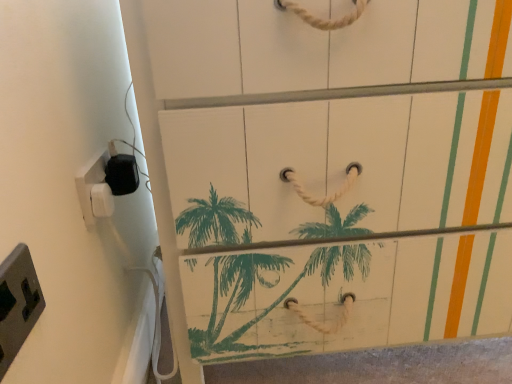
Question: Is gray plastic/light switch at lower left, acting as the third light switch starting from the back, oriented towards white plastic/light switch at left, which is counted as the third light switch, starting from the front?

Choices:
 (A) no
 (B) yes

Answer: (A)

Question: Can you confirm if gray plastic/light switch at lower left, placed as the 1th light switch when sorted from front to back, is positioned to the right of white plastic/light switch at left, which is counted as the third light switch, starting from the front?

Choices:
 (A) no
 (B) yes

Answer: (B)

Question: Is gray plastic/light switch at lower left, acting as the third light switch starting from the back, oriented away from white plastic/light switch at left, which appears as the first light switch when viewed from the back?

Choices:
 (A) no
 (B) yes

Answer: (A)

Question: Considering the relative sizes of gray plastic/light switch at lower left, acting as the third light switch starting from the back, and white plastic/light switch at left, which is counted as the third light switch, starting from the front, in the image provided, is gray plastic/light switch at lower left, acting as the third light switch starting from the back, smaller than white plastic/light switch at left, which is counted as the third light switch, starting from the front,?

Choices:
 (A) no
 (B) yes

Answer: (A)

Question: From a real-world perspective, is gray plastic/light switch at lower left, placed as the 1th light switch when sorted from front to back, positioned over white plastic/light switch at left, which is counted as the third light switch, starting from the front, based on gravity?

Choices:
 (A) yes
 (B) no

Answer: (A)

Question: Are gray plastic/light switch at lower left, acting as the third light switch starting from the back, and white plastic/light switch at left, which is counted as the third light switch, starting from the front, making contact?

Choices:
 (A) no
 (B) yes

Answer: (A)

Question: From a real-world perspective, is gray plastic/light switch at lower left, placed as the 1th light switch when sorted from front to back, below white plastic/light switch at left, marked as the second light switch in a front-to-back arrangement?

Choices:
 (A) no
 (B) yes

Answer: (B)

Question: Can you confirm if gray plastic/light switch at lower left, placed as the 1th light switch when sorted from front to back, is thinner than white plastic/light switch at left, which ranks as the second light switch in back-to-front order?

Choices:
 (A) yes
 (B) no

Answer: (B)

Question: Does gray plastic/light switch at lower left, acting as the third light switch starting from the back, have a larger size compared to white plastic/light switch at left, marked as the second light switch in a front-to-back arrangement?

Choices:
 (A) yes
 (B) no

Answer: (A)

Question: Is gray plastic/light switch at lower left, acting as the third light switch starting from the back, closer to camera compared to white plastic/light switch at left, marked as the second light switch in a front-to-back arrangement?

Choices:
 (A) no
 (B) yes

Answer: (B)

Question: Does gray plastic/light switch at lower left, placed as the 1th light switch when sorted from front to back, have a lesser height compared to white plastic/light switch at left, marked as the second light switch in a front-to-back arrangement?

Choices:
 (A) yes
 (B) no

Answer: (A)

Question: Considering the relative sizes of gray plastic/light switch at lower left, acting as the third light switch starting from the back, and white plastic/light switch at left, which ranks as the second light switch in back-to-front order, in the image provided, is gray plastic/light switch at lower left, acting as the third light switch starting from the back, smaller than white plastic/light switch at left, which ranks as the second light switch in back-to-front order,?

Choices:
 (A) yes
 (B) no

Answer: (B)

Question: From the image's perspective, is white plastic/light switch at left, which appears as the first light switch when viewed from the back, on top of white plastic/light switch at left, marked as the second light switch in a front-to-back arrangement?

Choices:
 (A) yes
 (B) no

Answer: (B)